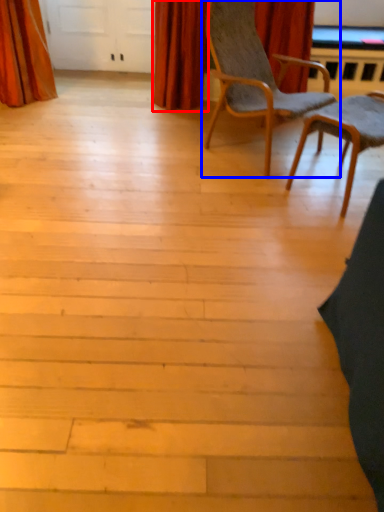
Question: Which point is closer to the camera, curtain (highlighted by a red box) or chair (highlighted by a blue box)?

Choices:
 (A) curtain
 (B) chair

Answer: (B)